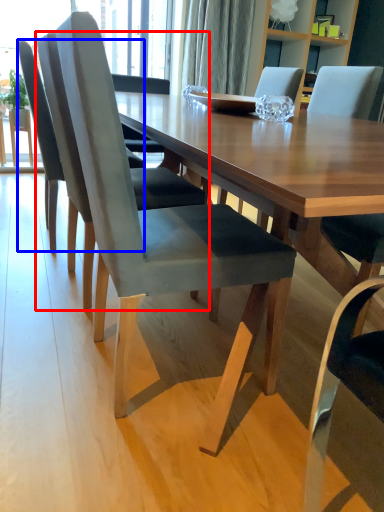
Question: Among these objects, which one is nearest to the camera, chair (highlighted by a red box) or chair (highlighted by a blue box)?

Choices:
 (A) chair
 (B) chair

Answer: (A)